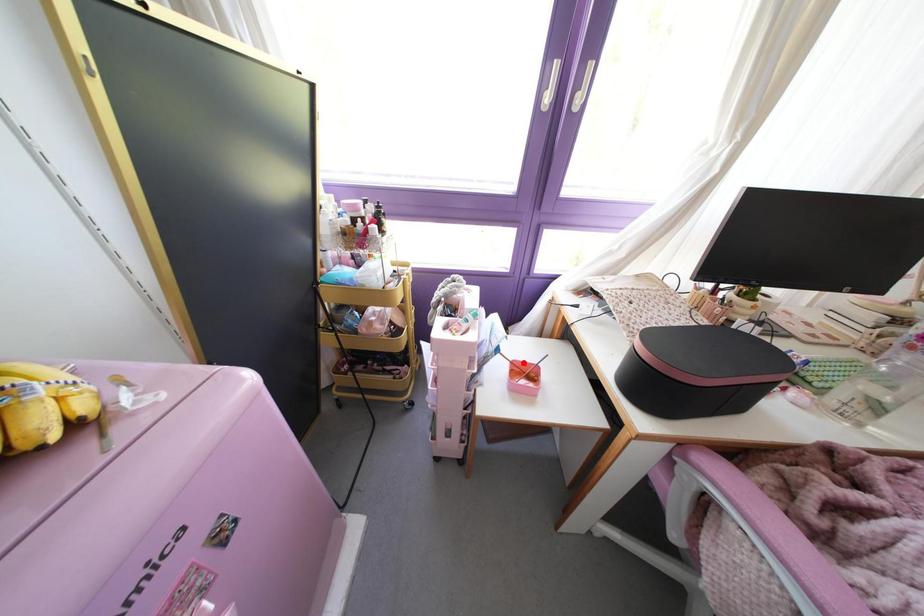
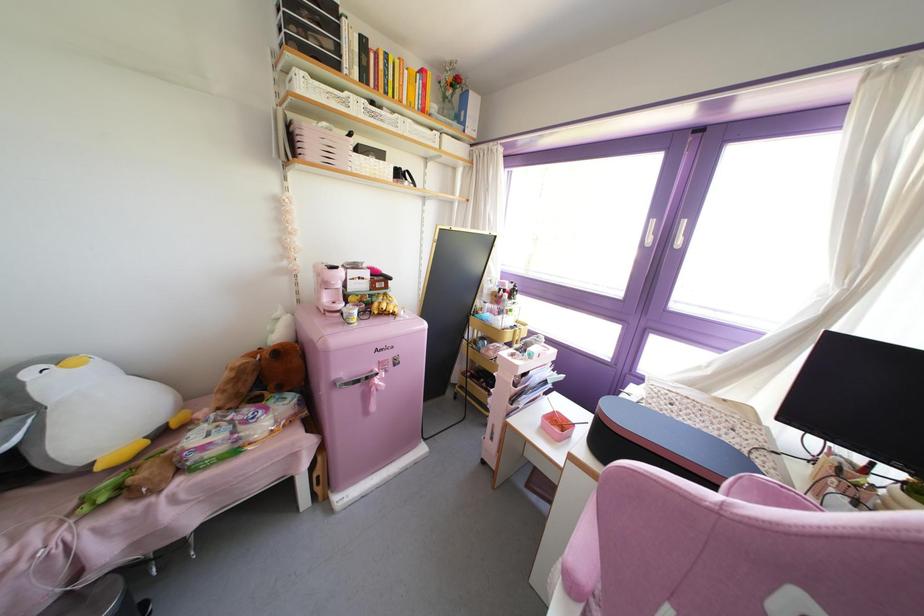
Question: I am providing you with two images of the same scene from different viewpoints. In image1, a red point is highlighted. Considering the same 3D point in image2, which of the following is correct?

Choices:
 (A) It is closer
 (B) It is farther

Answer: (A)